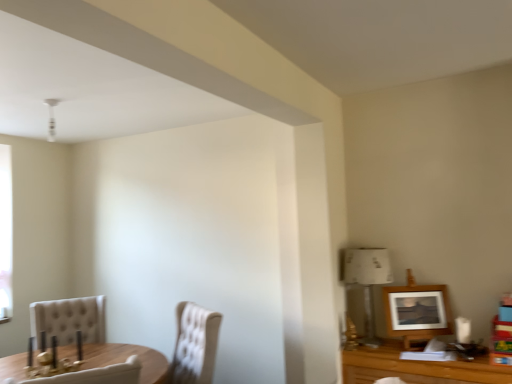
The width and height of the screenshot is (512, 384). In order to click on beige tufted chair at lower left, which is the 2th chair from right to left in this screenshot , I will do `click(69, 319)`.

Measure the distance between tufted fabric chair at lower left, marked as the 1th chair in a right-to-left arrangement, and camera.

The depth of tufted fabric chair at lower left, marked as the 1th chair in a right-to-left arrangement, is 8.20 feet.

Identify the location of tufted fabric chair at lower left, the second chair positioned from the left. (193, 345).

You are a GUI agent. You are given a task and a screenshot of the screen. Output one action in this format:
    pyautogui.click(x=<x>, y=<y>)
    Task: Click on the beige tufted chair at lower left, the 1th chair when ordered from left to right
    
    Given the screenshot: What is the action you would take?
    pyautogui.click(x=69, y=319)

In the scene shown: Are wooden picture frame at upper right and beige tufted chair at lower left, the 1th chair when ordered from left to right, located far from each other?

Yes.

Is point (447, 297) positioned behind point (39, 345)?

No, (447, 297) is in front of (39, 345).

Is wooden picture frame at upper right bigger or smaller than beige tufted chair at lower left, which is the 2th chair from right to left?

In the image, wooden picture frame at upper right appears to be smaller than beige tufted chair at lower left, which is the 2th chair from right to left.

The image size is (512, 384). Identify the location of chair behind the wooden picture frame at upper right. (69, 319).

Would you say tufted fabric chair at lower left, marked as the 1th chair in a right-to-left arrangement, is part of beige tufted chair at lower left, which is the 2th chair from right to left,'s contents?

No, tufted fabric chair at lower left, marked as the 1th chair in a right-to-left arrangement, is not a part of beige tufted chair at lower left, which is the 2th chair from right to left.

Which is more to the left, beige tufted chair at lower left, which is the 2th chair from right to left, or tufted fabric chair at lower left, marked as the 1th chair in a right-to-left arrangement?

beige tufted chair at lower left, which is the 2th chair from right to left.

Can you confirm if beige tufted chair at lower left, which is the 2th chair from right to left, is thinner than tufted fabric chair at lower left, the second chair positioned from the left?

Yes.

How distant is beige tufted chair at lower left, the 1th chair when ordered from left to right, from tufted fabric chair at lower left, marked as the 1th chair in a right-to-left arrangement?

A distance of 31.43 inches exists between beige tufted chair at lower left, the 1th chair when ordered from left to right, and tufted fabric chair at lower left, marked as the 1th chair in a right-to-left arrangement.

From a real-world perspective, is tufted fabric chair at lower left, the second chair positioned from the left, below wooden picture frame at upper right?

Indeed, from a real-world perspective, tufted fabric chair at lower left, the second chair positioned from the left, is positioned beneath wooden picture frame at upper right.

From the image's perspective, between tufted fabric chair at lower left, marked as the 1th chair in a right-to-left arrangement, and wooden picture frame at upper right, who is located below?

tufted fabric chair at lower left, marked as the 1th chair in a right-to-left arrangement, from the image's perspective.

Consider the image. Considering the relative sizes of tufted fabric chair at lower left, marked as the 1th chair in a right-to-left arrangement, and wooden picture frame at upper right in the image provided, is tufted fabric chair at lower left, marked as the 1th chair in a right-to-left arrangement, shorter than wooden picture frame at upper right?

No, tufted fabric chair at lower left, marked as the 1th chair in a right-to-left arrangement, is not shorter than wooden picture frame at upper right.

Can you tell me how much tufted fabric chair at lower left, the second chair positioned from the left, and wooden picture frame at upper right differ in facing direction?

The angle between the facing direction of tufted fabric chair at lower left, the second chair positioned from the left, and the facing direction of wooden picture frame at upper right is 58 degrees.

Considering their positions, is tufted fabric chair at lower left, marked as the 1th chair in a right-to-left arrangement, located in front of or behind white paper lampshade at right?

tufted fabric chair at lower left, marked as the 1th chair in a right-to-left arrangement, is in front of white paper lampshade at right.

Can you confirm if tufted fabric chair at lower left, the second chair positioned from the left, is positioned to the left of white paper lampshade at right?

Yes.

Does beige tufted chair at lower left, the 1th chair when ordered from left to right, touch wooden picture frame at upper right?

They are not placed beside each other.

Can you confirm if beige tufted chair at lower left, which is the 2th chair from right to left, is shorter than wooden picture frame at upper right?

No.

Does beige tufted chair at lower left, the 1th chair when ordered from left to right, turn towards wooden picture frame at upper right?

No, beige tufted chair at lower left, the 1th chair when ordered from left to right, is not turned towards wooden picture frame at upper right.

Can you confirm if beige tufted chair at lower left, the 1th chair when ordered from left to right, is wider than wooden picture frame at upper right?

Yes.

Which is behind, point (435, 298) or point (347, 282)?

Point (347, 282)

Based on their sizes in the image, would you say wooden picture frame at upper right is bigger or smaller than white paper lampshade at right?

In the image, wooden picture frame at upper right appears to be smaller than white paper lampshade at right.

Would you say wooden picture frame at upper right is outside white paper lampshade at right?

wooden picture frame at upper right is positioned outside white paper lampshade at right.

Which object is further away from the camera, beige tufted chair at lower left, the 1th chair when ordered from left to right, or white paper lampshade at right?

beige tufted chair at lower left, the 1th chair when ordered from left to right, is further from the camera.

Is beige tufted chair at lower left, which is the 2th chair from right to left, positioned with its back to white paper lampshade at right?

No, beige tufted chair at lower left, which is the 2th chair from right to left, is not facing the opposite direction of white paper lampshade at right.

Considering the positions of objects beige tufted chair at lower left, the 1th chair when ordered from left to right, and white paper lampshade at right in the image provided, who is more to the left, beige tufted chair at lower left, the 1th chair when ordered from left to right, or white paper lampshade at right?

Positioned to the left is beige tufted chair at lower left, the 1th chair when ordered from left to right.

You are a GUI agent. You are given a task and a screenshot of the screen. Output one action in this format:
    pyautogui.click(x=<x>, y=<y>)
    Task: Click on the 1st chair below the wooden picture frame at upper right (from the image's perspective)
    The image size is (512, 384).
    Given the screenshot: What is the action you would take?
    pyautogui.click(x=69, y=319)

Find the location of a particular element. Image resolution: width=512 pixels, height=384 pixels. chair above the tufted fabric chair at lower left, the second chair positioned from the left (from the image's perspective) is located at coordinates (69, 319).

Which object lies nearer to the anchor point white paper lampshade at right, tufted fabric chair at lower left, the second chair positioned from the left, or beige tufted chair at lower left, the 1th chair when ordered from left to right?

The object closer to white paper lampshade at right is tufted fabric chair at lower left, the second chair positioned from the left.

From the picture: Which object lies nearer to the anchor point white paper lampshade at right, wooden picture frame at upper right or beige tufted chair at lower left, the 1th chair when ordered from left to right?

wooden picture frame at upper right.

Considering their positions, is white paper lampshade at right positioned further to wooden picture frame at upper right than beige tufted chair at lower left, the 1th chair when ordered from left to right?

beige tufted chair at lower left, the 1th chair when ordered from left to right, lies further to wooden picture frame at upper right than the other object.

Estimate the real-world distances between objects in this image. Which object is further from white paper lampshade at right, tufted fabric chair at lower left, the second chair positioned from the left, or wooden picture frame at upper right?

tufted fabric chair at lower left, the second chair positioned from the left, lies further to white paper lampshade at right than the other object.

Looking at the image, which one is located further to wooden picture frame at upper right, tufted fabric chair at lower left, the second chair positioned from the left, or white paper lampshade at right?

tufted fabric chair at lower left, the second chair positioned from the left, is positioned further to the anchor wooden picture frame at upper right.

Considering their positions, is wooden picture frame at upper right positioned further to tufted fabric chair at lower left, the second chair positioned from the left, than white paper lampshade at right?

wooden picture frame at upper right is further to tufted fabric chair at lower left, the second chair positioned from the left.

When comparing their distances from tufted fabric chair at lower left, marked as the 1th chair in a right-to-left arrangement, does beige tufted chair at lower left, the 1th chair when ordered from left to right, or wooden picture frame at upper right seem further?

wooden picture frame at upper right is further to tufted fabric chair at lower left, marked as the 1th chair in a right-to-left arrangement.

Considering their positions, is white paper lampshade at right positioned further to tufted fabric chair at lower left, the second chair positioned from the left, than wooden picture frame at upper right?

Among the two, wooden picture frame at upper right is located further to tufted fabric chair at lower left, the second chair positioned from the left.

This screenshot has width=512, height=384. I want to click on chair between beige tufted chair at lower left, which is the 2th chair from right to left, and white paper lampshade at right, in the horizontal direction, so click(193, 345).

Where is `chair located between beige tufted chair at lower left, which is the 2th chair from right to left, and wooden picture frame at upper right in the left-right direction`? chair located between beige tufted chair at lower left, which is the 2th chair from right to left, and wooden picture frame at upper right in the left-right direction is located at coordinates (193, 345).

The image size is (512, 384). Find the location of `lamp located between tufted fabric chair at lower left, the second chair positioned from the left, and wooden picture frame at upper right in the left-right direction`. lamp located between tufted fabric chair at lower left, the second chair positioned from the left, and wooden picture frame at upper right in the left-right direction is located at coordinates (367, 281).

This screenshot has width=512, height=384. In order to click on lamp situated between beige tufted chair at lower left, which is the 2th chair from right to left, and wooden picture frame at upper right from left to right in this screenshot , I will do `click(367, 281)`.